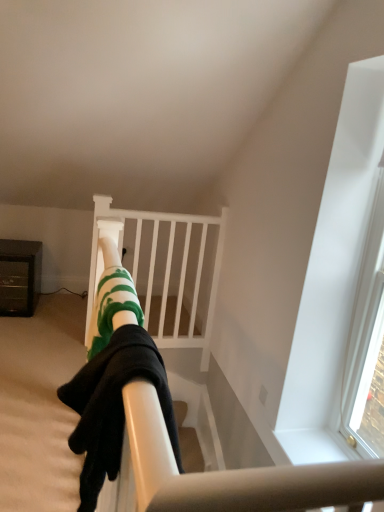
Question: Considering the positions of green striped socks at center and brushed metal cabinet at left in the image, is green striped socks at center bigger or smaller than brushed metal cabinet at left?

Choices:
 (A) small
 (B) big

Answer: (A)

Question: Looking at their shapes, would you say green striped socks at center is wider or thinner than brushed metal cabinet at left?

Choices:
 (A) wide
 (B) thin

Answer: (B)

Question: Which object is positioned closest to the brushed metal cabinet at left?

Choices:
 (A) green striped socks at center
 (B) white matte bunk bed at center

Answer: (B)

Question: Considering the real-world distances, which object is closest to the white matte bunk bed at center?

Choices:
 (A) brushed metal cabinet at left
 (B) green striped socks at center

Answer: (A)